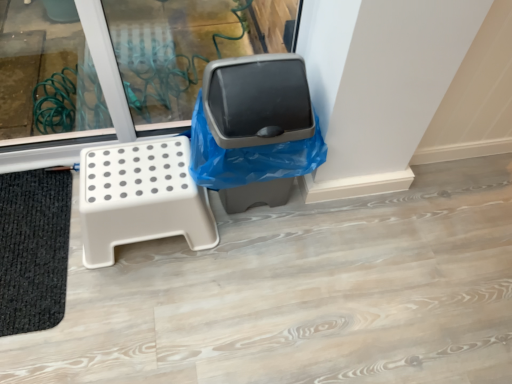
Identify the location of vacant space underneath black textured bath mat at lower left (from a real-world perspective). (29, 234).